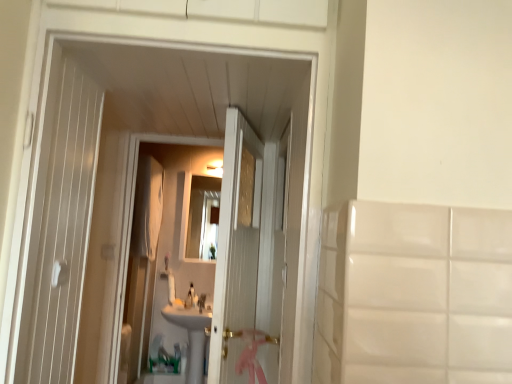
Question: From the image's perspective, relative to white glossy soap at center, is white wooden door at center above or below?

Choices:
 (A) below
 (B) above

Answer: (B)

Question: Does point (230, 226) appear closer or farther from the camera than point (178, 302)?

Choices:
 (A) farther
 (B) closer

Answer: (B)

Question: Estimate the real-world distances between objects in this image. Which object is closer to the white glossy soap at center?

Choices:
 (A) white glossy sink at center
 (B) white glossy faucet at center, placed as the 2th faucet when sorted from left to right
 (C) white fabric screen door at left
 (D) white wooden door at center
 (E) white glossy faucet at center, marked as the first faucet in a left-to-right arrangement

Answer: (E)

Question: Estimate the real-world distances between objects in this image. Which object is closer to the white glossy sink at center?

Choices:
 (A) white glossy soap at center
 (B) white glossy faucet at center, marked as the first faucet in a left-to-right arrangement
 (C) white fabric screen door at left
 (D) white wooden door at center
 (E) white glossy faucet at center, placed as the 2th faucet when sorted from left to right

Answer: (E)